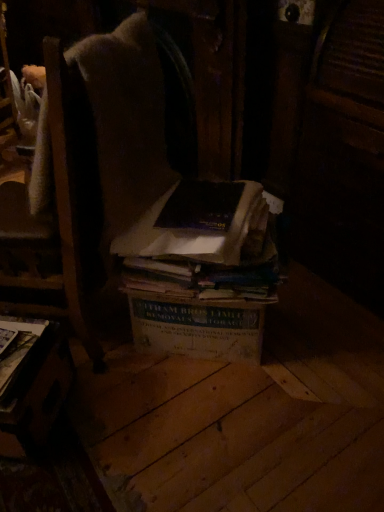
Question: Would you say hardcover book at lower left, the 1th book positioned from the left, is inside or outside dark brown paper book at center, the second book when ordered from right to left?

Choices:
 (A) outside
 (B) inside

Answer: (A)

Question: From a real-world perspective, is hardcover book at lower left, the 1th book positioned from the left, physically located above or below dark brown paper book at center, acting as the second book starting from the left?

Choices:
 (A) below
 (B) above

Answer: (A)

Question: Estimate the real-world distances between objects in this image. Which object is closer to the wooden table at lower left?

Choices:
 (A) hardcover book at lower left, the 1th book positioned from the left
 (B) brown cardboard box at center, the 1th book viewed from the right
 (C) dark brown paper book at center, the second book when ordered from right to left

Answer: (A)

Question: Which is nearer to the wooden table at lower left?

Choices:
 (A) hardcover book at lower left, the third book in the right-to-left sequence
 (B) dark brown paper book at center, the second book when ordered from right to left
 (C) brown cardboard box at center, the 1th book viewed from the right

Answer: (A)